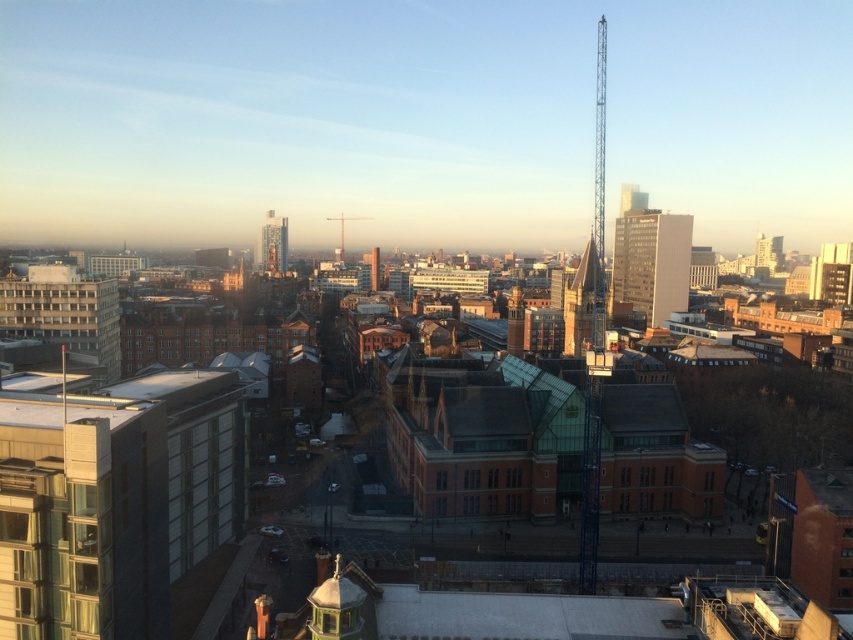
Is matte glass skyscraper at upper right thinner than brick spire at center?

Yes, matte glass skyscraper at upper right is thinner than brick spire at center.

Does point (665, 252) lie behind point (368, 216)?

No.

Does point (656, 241) come farther from viewer compared to point (341, 218)?

No.

I want to click on matte glass skyscraper at upper right, so click(x=651, y=262).

Is brick tower at center to the left of glassy teal skyscraper at center-left from the viewer's perspective?

Incorrect, brick tower at center is not on the left side of glassy teal skyscraper at center-left.

Does point (579, 305) come in front of point (263, 252)?

Yes, it is in front of point (263, 252).

I want to click on brick tower at center, so click(579, 304).

Does matte glass skyscraper at upper right have a lesser height compared to glassy teal skyscraper at center-left?

Incorrect, matte glass skyscraper at upper right's height does not fall short of glassy teal skyscraper at center-left's.

Who is positioned more to the right, matte glass skyscraper at upper right or glassy teal skyscraper at center-left?

matte glass skyscraper at upper right is more to the right.

Is point (642, 212) in front of point (262, 248)?

Yes, it is.

Locate an element on the screen. matte glass skyscraper at upper right is located at coordinates (651, 262).